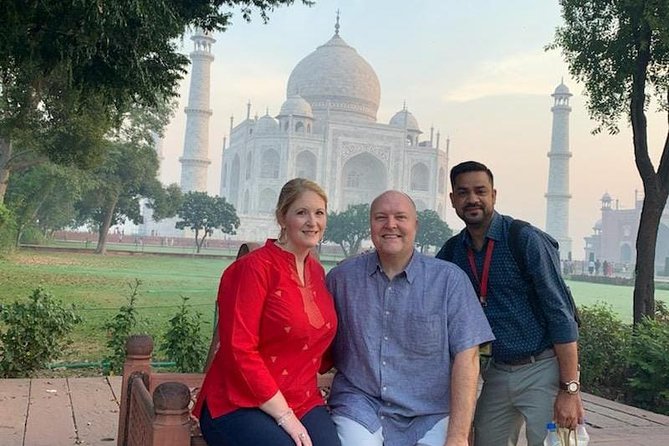
The height and width of the screenshot is (446, 669). In order to click on bench in this screenshot , I will do `click(138, 402)`.